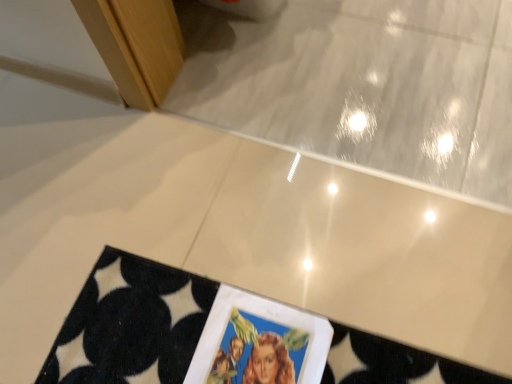
This screenshot has height=384, width=512. Describe the element at coordinates (259, 343) in the screenshot. I see `white glossy tablet at center` at that location.

The image size is (512, 384). In order to click on white glossy tablet at center in this screenshot , I will do `click(259, 343)`.

This screenshot has width=512, height=384. In order to click on white glossy tablet at center in this screenshot , I will do `click(259, 343)`.